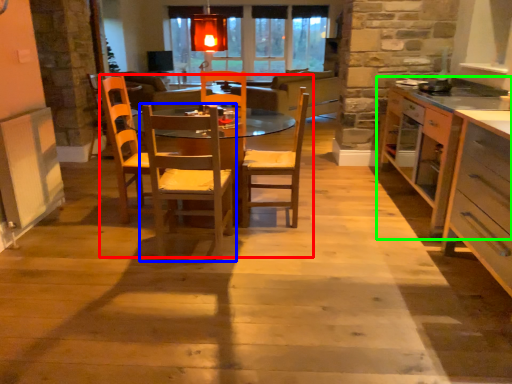
Question: Which is nearer to the kitchen & dining room table (highlighted by a red box)? chair (highlighted by a blue box) or countertop (highlighted by a green box).

Choices:
 (A) chair
 (B) countertop

Answer: (A)